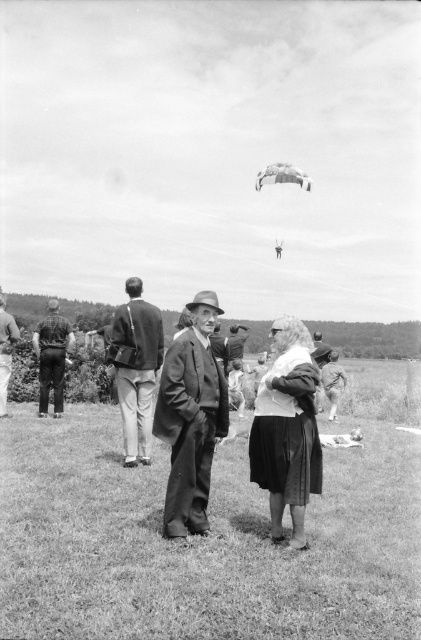
Is green grass at center to the left of checkered fabric shirt at left from the viewer's perspective?

Incorrect, green grass at center is not on the left side of checkered fabric shirt at left.

Can you confirm if green grass at center is positioned below checkered fabric shirt at left?

Indeed, green grass at center is positioned under checkered fabric shirt at left.

Locate an element on the screen. The width and height of the screenshot is (421, 640). green grass at center is located at coordinates (202, 541).

You are a GUI agent. You are given a task and a screenshot of the screen. Output one action in this format:
    pyautogui.click(x=<x>, y=<y>)
    Task: Click on the green grass at center
    The height and width of the screenshot is (640, 421).
    Given the screenshot: What is the action you would take?
    pyautogui.click(x=202, y=541)

Which is above, smooth black suit at center or white fabric parachute at upper center?

white fabric parachute at upper center

Does point (165, 506) lie in front of point (301, 186)?

Yes, point (165, 506) is in front of point (301, 186).

Where is `smooth black suit at center`? The width and height of the screenshot is (421, 640). smooth black suit at center is located at coordinates (191, 419).

Is point (7, 314) closer to viewer compared to point (272, 180)?

Yes, point (7, 314) is closer to viewer.

Can you confirm if smooth leather jacket at center is bigger than white fabric parachute at upper center?

No.

Between point (10, 337) and point (284, 168), which one is positioned in front?

Positioned in front is point (10, 337).

Locate an element on the screen. The height and width of the screenshot is (640, 421). smooth leather jacket at center is located at coordinates (5, 352).